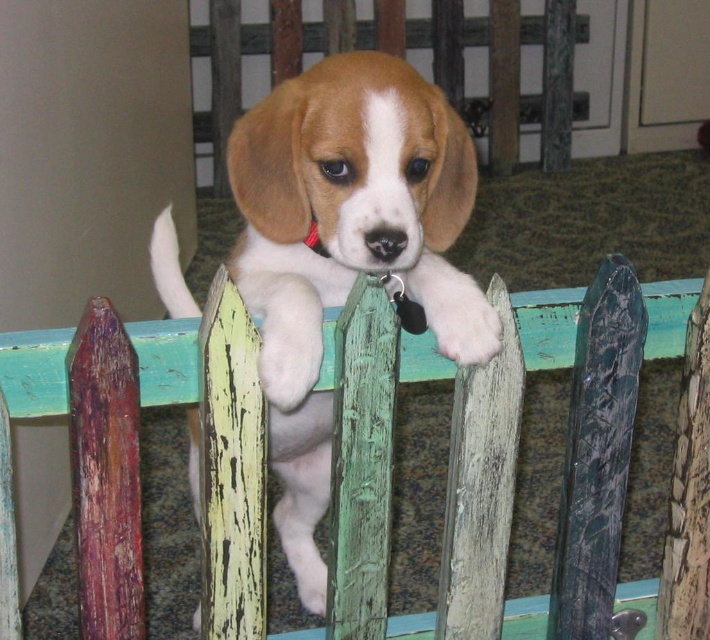
You are a photographer trying to capture the light brown fur at center of the beagle puppy behind the wooden picket fence at center. Since the fence is smaller than the puppy, will the fence block the entire puppy in the photo?

The wooden picket fence at center is smaller than the light brown fur at center, so the fence will not block the entire puppy in the photo.

You are a photographer holding a camera. You want to take a picture of the wooden picket fence at center from a distance that allows you to capture the entire fence in the frame. If your camera has a maximum focus distance of 1 meter, will you be able to take the photo clearly?

The wooden picket fence at center and camera are 99.65 centimeters apart. Since 99.65 cm is less than 1 meter, the camera can focus clearly on the wooden picket fence at center, so yes, you can take the photo clearly.

In the image, you see a wooden picket fence at center and a light brown fur at center. Which object is positioned to the right from your perspective?

The wooden picket fence at center is to the right of the light brown fur at center.